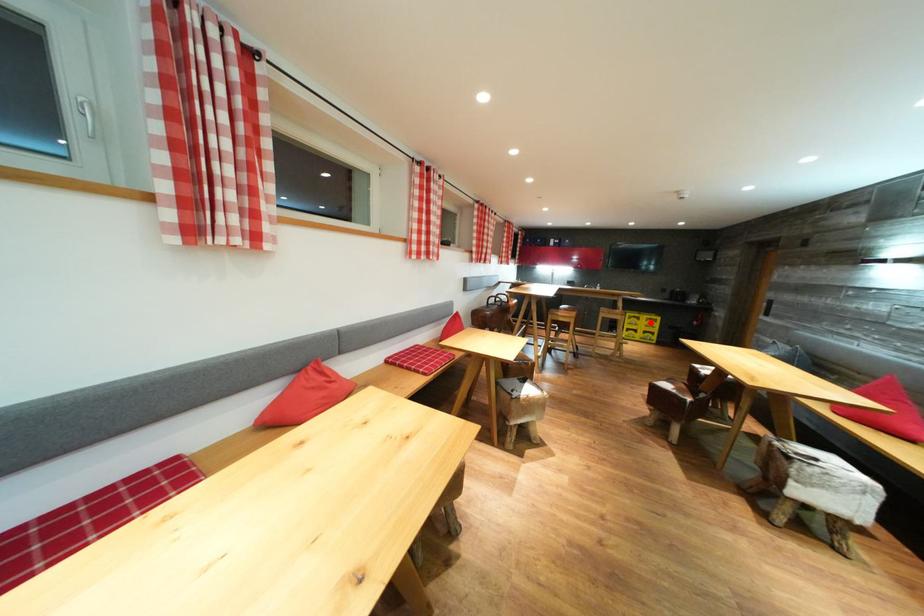
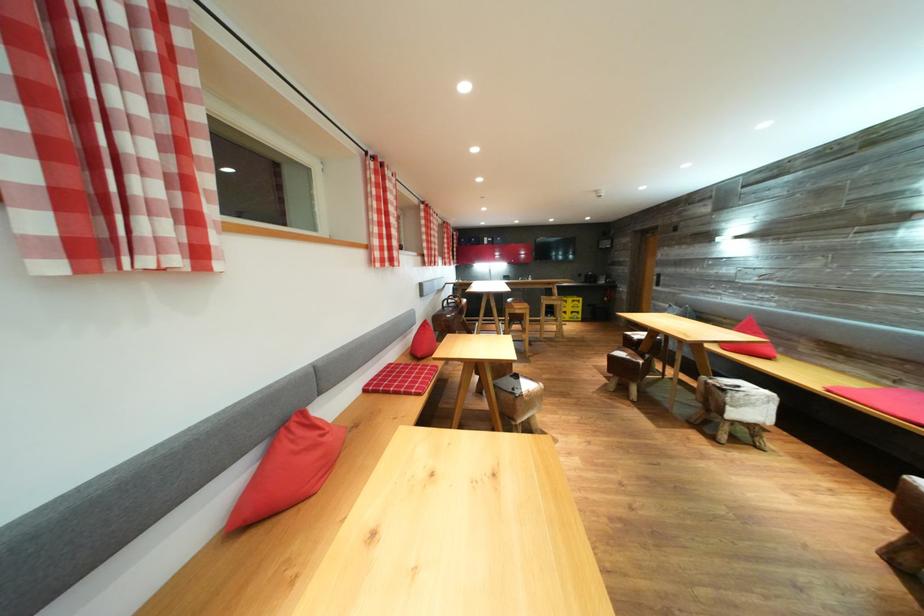
In the second image, find the point that corresponds to the highlighted location in the first image.

(577, 305)